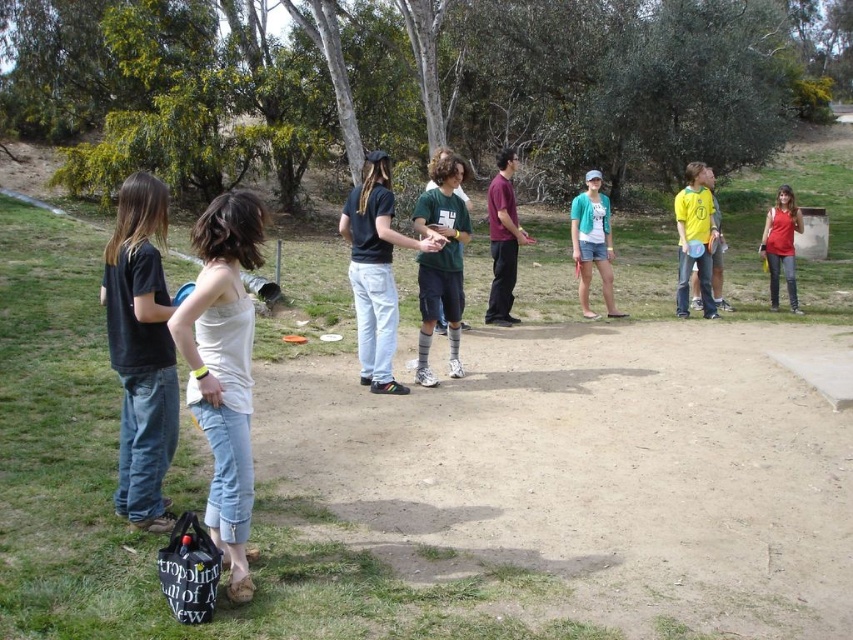
Who is positioned more to the right, black cotton shirt at left or maroon fabric shirt at center?

Positioned to the right is maroon fabric shirt at center.

Can you confirm if black cotton shirt at left is wider than maroon fabric shirt at center?

Yes.

You are a GUI agent. You are given a task and a screenshot of the screen. Output one action in this format:
    pyautogui.click(x=<x>, y=<y>)
    Task: Click on the black cotton shirt at left
    This screenshot has width=853, height=640.
    Given the screenshot: What is the action you would take?
    pyautogui.click(x=141, y=349)

Where is `black cotton shirt at left`? This screenshot has height=640, width=853. black cotton shirt at left is located at coordinates (141, 349).

Who is taller, dark blue t-shirt at center or matte red tank top at right?

Standing taller between the two is dark blue t-shirt at center.

Between point (383, 164) and point (784, 214), which one is positioned behind?

The point (784, 214) is behind.

The width and height of the screenshot is (853, 640). Find the location of `dark blue t-shirt at center`. dark blue t-shirt at center is located at coordinates (376, 269).

Can you confirm if yellow jersey at right is shorter than matte green t-shirt at center?

No.

Which is more to the right, yellow jersey at right or matte green t-shirt at center?

yellow jersey at right is more to the right.

Does point (701, 296) lie behind point (577, 275)?

Yes, it is.

Where is `yellow jersey at right`? yellow jersey at right is located at coordinates (694, 237).